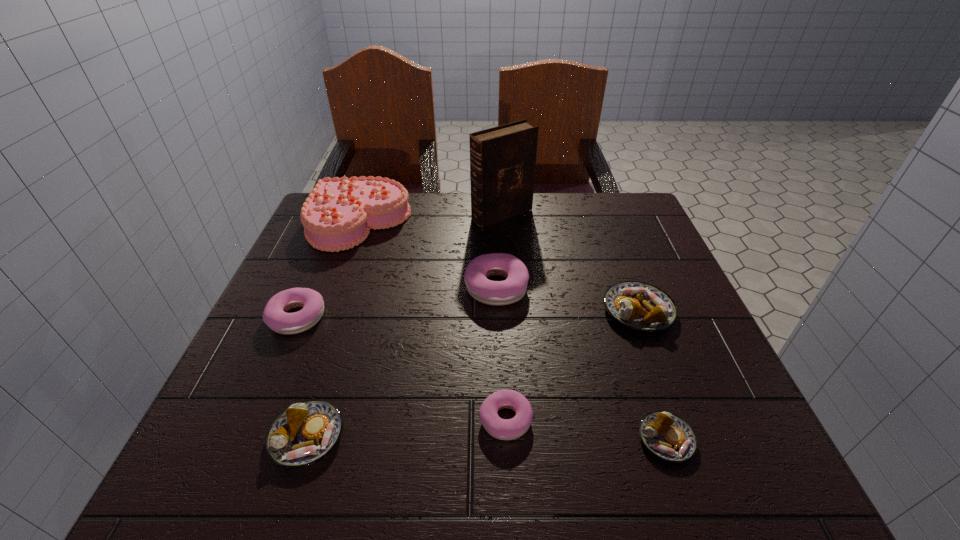
The image size is (960, 540). Identify the location of free spot that satisfies the following two spatial constraints: 1. on the front side of the smallest pink pastry; 2. on the left side of the biggest pink pastry. (502, 420).